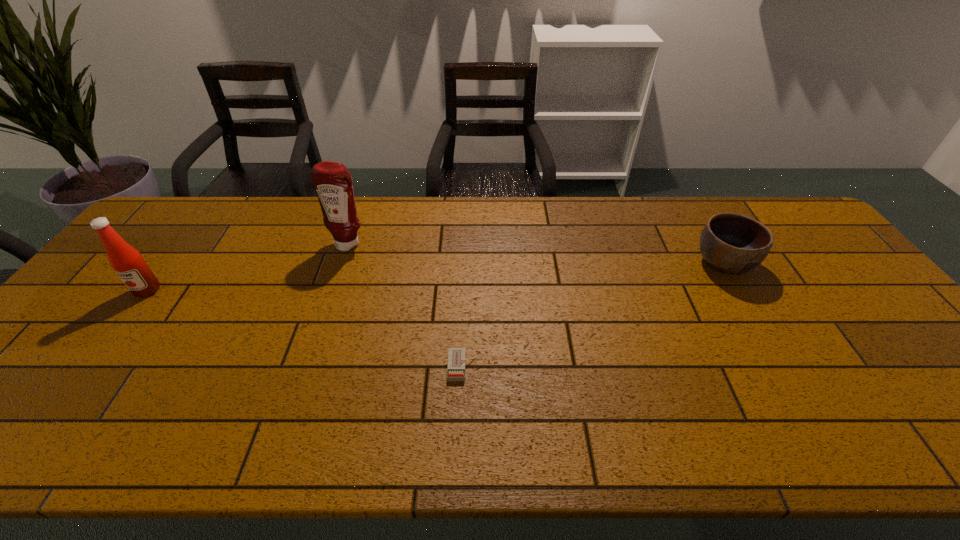
In order to click on the third object from right to left in this screenshot , I will do `click(333, 183)`.

Locate an element on the screen. The width and height of the screenshot is (960, 540). the farther condiment is located at coordinates point(333,183).

The width and height of the screenshot is (960, 540). Identify the location of the leftmost object. (127, 262).

The width and height of the screenshot is (960, 540). Identify the location of the nearer condiment. (127, 262).

Find the location of a particular element. the third tallest object is located at coordinates pos(731,243).

The width and height of the screenshot is (960, 540). Find the location of `bowl`. bowl is located at coordinates (731, 243).

This screenshot has height=540, width=960. In order to click on the nearest object in this screenshot , I will do `click(456, 356)`.

This screenshot has width=960, height=540. In order to click on the shortest object in this screenshot , I will do `click(456, 356)`.

Image resolution: width=960 pixels, height=540 pixels. What are the coordinates of `free space located on the back of the right condiment` in the screenshot? It's located at (364, 199).

The width and height of the screenshot is (960, 540). I want to click on blank space located on the front-facing side of the leftmost object, so click(x=103, y=349).